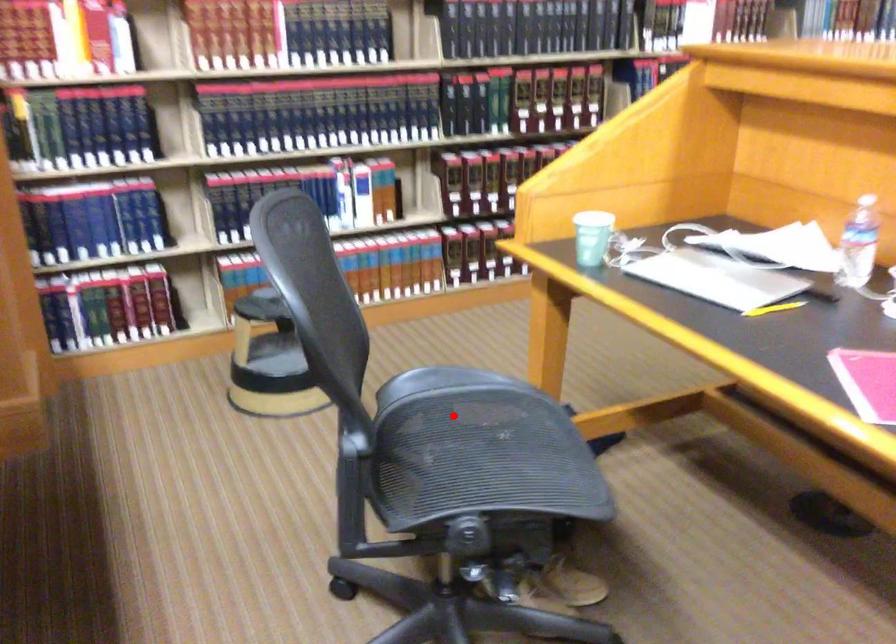
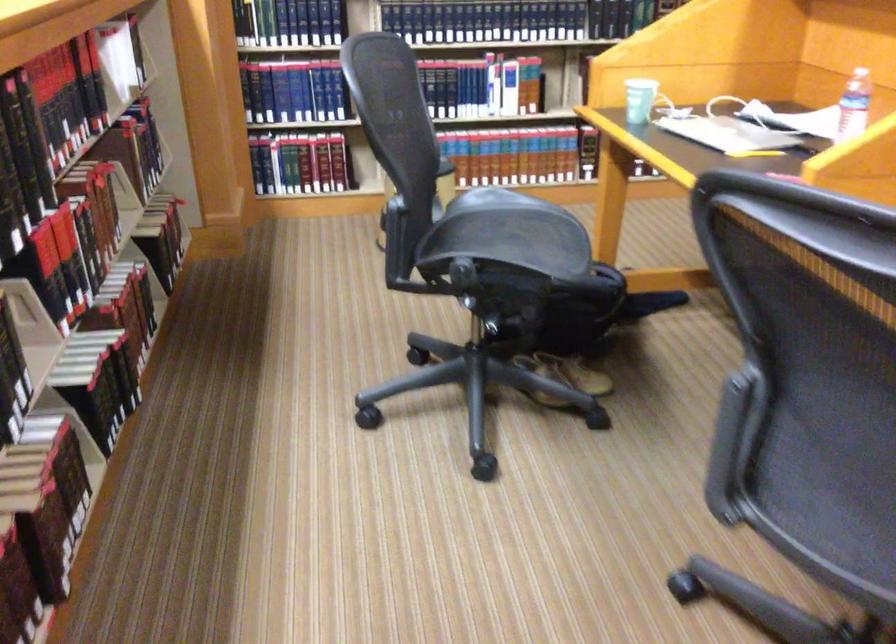
Question: A red point is marked in image1. In image2, is the corresponding 3D point closer to the camera or farther? Reply with the corresponding letter.

Choices:
 (A) The corresponding 3D point is closer.
 (B) The corresponding 3D point is farther.

Answer: (B)